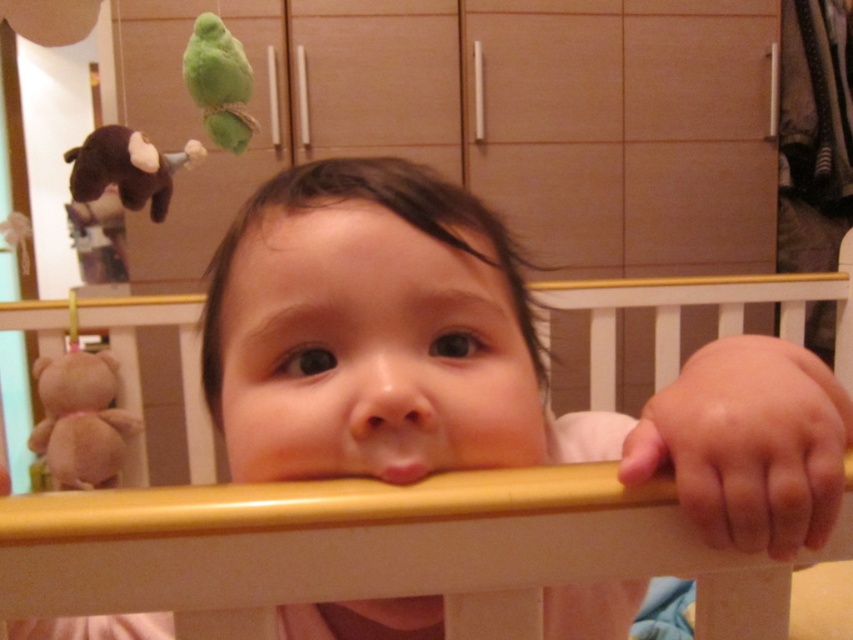
Is brown plush monkey at left below pink matte mouth at center?

No, brown plush monkey at left is not below pink matte mouth at center.

Based on the photo, can you confirm if brown plush monkey at left is wider than pink matte mouth at center?

Correct, the width of brown plush monkey at left exceeds that of pink matte mouth at center.

The height and width of the screenshot is (640, 853). Identify the location of brown plush monkey at left. (126, 168).

Between point (56, 467) and point (225, 68), which one is positioned behind?

Point (56, 467)

Who is higher up, brown plush bear at left or green plush parrot at upper left?

Positioned higher is green plush parrot at upper left.

Who is more forward, (51, 417) or (227, 36)?

Point (227, 36)

The width and height of the screenshot is (853, 640). I want to click on brown plush bear at left, so click(x=80, y=419).

Is brown plush bear at left taller than brown plush monkey at left?

Indeed, brown plush bear at left has a greater height compared to brown plush monkey at left.

Locate an element on the screen. This screenshot has height=640, width=853. brown plush bear at left is located at coordinates (80, 419).